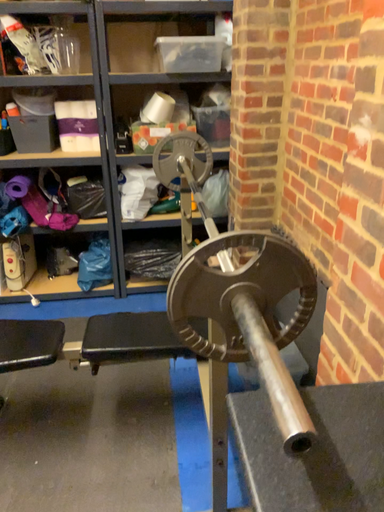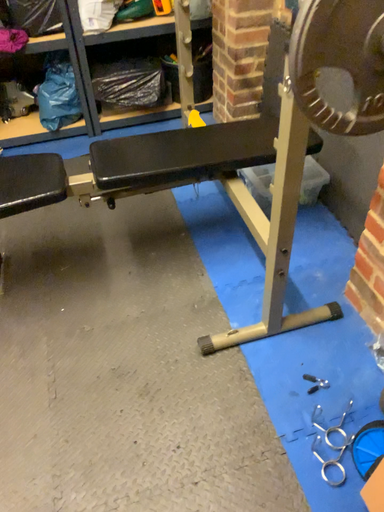
Question: Which way did the camera rotate in the video?

Choices:
 (A) rotated right
 (B) rotated left

Answer: (A)